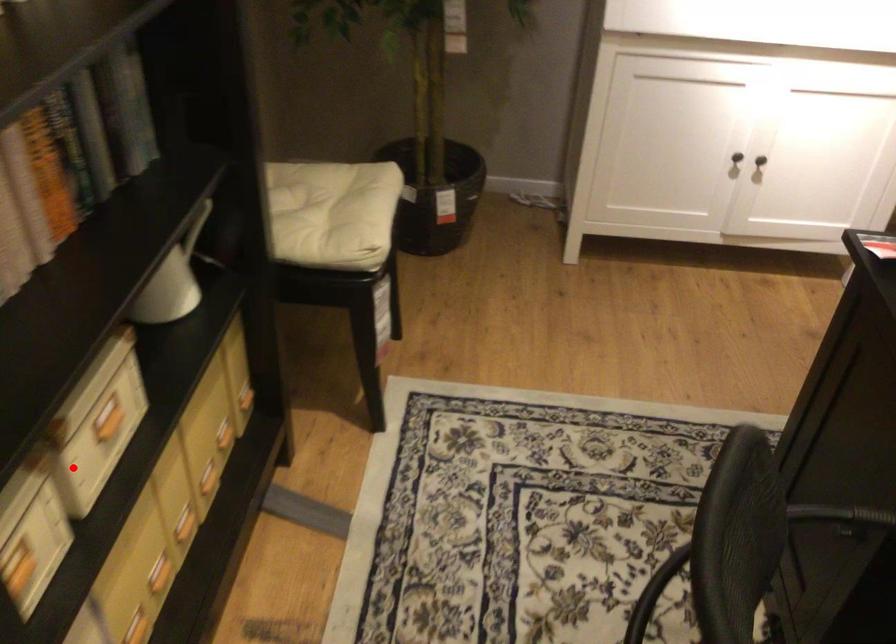
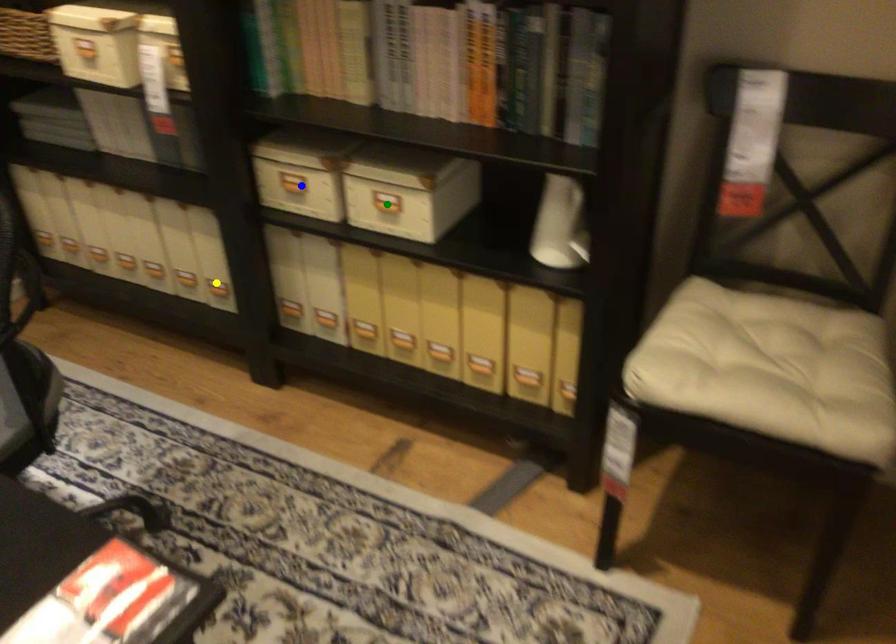
Question: I am providing you with two images of the same scene from different viewpoints. A red point is marked on the first image. You are given multiple points on the second image. In image 2, which mark is for the same physical point as the one in image 1?

Choices:
 (A) green point
 (B) yellow point
 (C) blue point

Answer: (A)